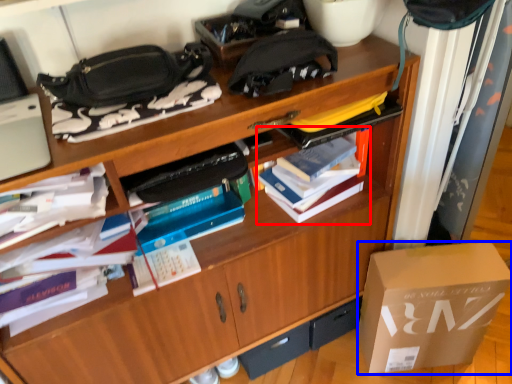
Question: Which of the following is the closest to the observer, book (highlighted by a red box) or box (highlighted by a blue box)?

Choices:
 (A) book
 (B) box

Answer: (A)